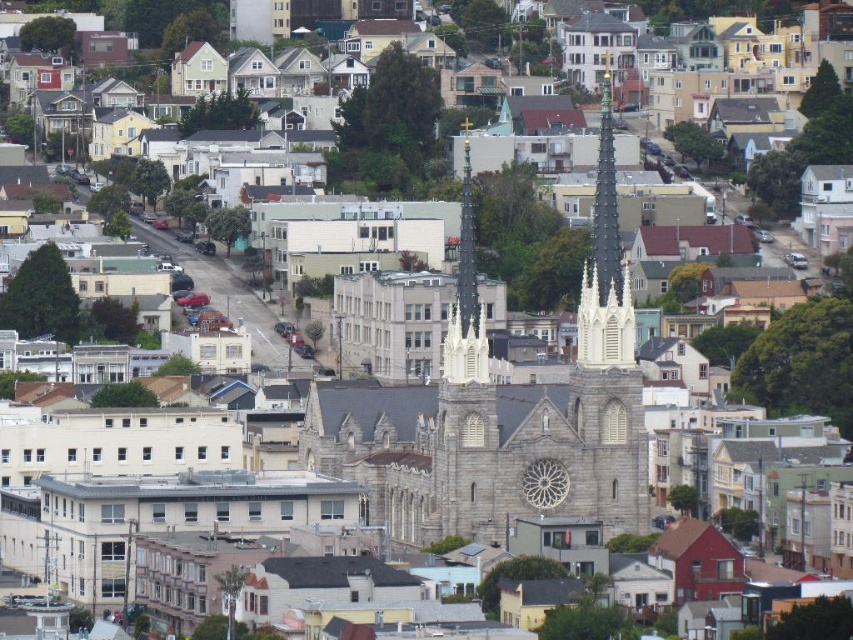
Question: Does gray stone church spire at center appear on the right side of white stone spire at center?

Choices:
 (A) no
 (B) yes

Answer: (A)

Question: Which point is farther to the camera?

Choices:
 (A) (602, 438)
 (B) (608, 196)

Answer: (A)

Question: Does gray stone church spire at center come behind white stone spire at center?

Choices:
 (A) no
 (B) yes

Answer: (A)

Question: Does gray stone church spire at center have a greater width compared to white stone spire at center?

Choices:
 (A) no
 (B) yes

Answer: (B)